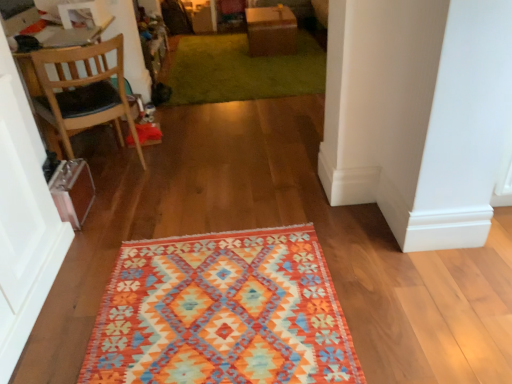
At what (x,y) coordinates should I click in order to perform the action: click on free point below wooden chair at left (from a real-world perspective). Please return your answer as a coordinate pair (x, y). Looking at the image, I should click on (112, 170).